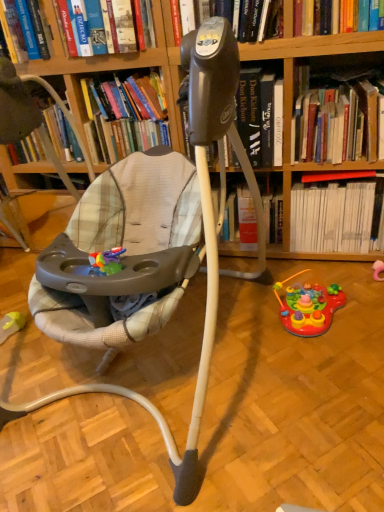
What do you see at coordinates (378, 270) in the screenshot? I see `pink rubber toy at lower right, the 1th toy viewed from the right` at bounding box center [378, 270].

Find the location of `rubber yellow toy at lower left, which is the 3th toy from right to left`. rubber yellow toy at lower left, which is the 3th toy from right to left is located at coordinates (11, 325).

Image resolution: width=384 pixels, height=512 pixels. Identify the location of black plastic tripod at center. (261, 112).

The width and height of the screenshot is (384, 512). I want to click on pink rubber toy at lower right, positioned as the 3th toy in left-to-right order, so click(x=378, y=270).

Considering the positions of objects rubberized plastic activity center at lower right, the 2th toy positioned from the left, and black plastic tripod at center in the image provided, who is more to the left, rubberized plastic activity center at lower right, the 2th toy positioned from the left, or black plastic tripod at center?

From the viewer's perspective, black plastic tripod at center appears more on the left side.

From a real-world perspective, is rubberized plastic activity center at lower right, the 2th toy positioned from the right, positioned above or below black plastic tripod at center?

In terms of real-world spatial position, rubberized plastic activity center at lower right, the 2th toy positioned from the right, is below black plastic tripod at center.

Is black plastic tripod at center at the back of rubberized plastic activity center at lower right, the 2th toy positioned from the left?

rubberized plastic activity center at lower right, the 2th toy positioned from the left, does not have its back to black plastic tripod at center.

Considering the positions of point (309, 330) and point (245, 117), is point (309, 330) closer or farther from the camera than point (245, 117)?

Clearly, point (309, 330) is closer to the camera than point (245, 117).

Consider the image. Is black plastic tripod at center facing away from hardcover book at upper right, the 3th book positioned from the left?

No, black plastic tripod at center's orientation is not away from hardcover book at upper right, the 3th book positioned from the left.

This screenshot has width=384, height=512. In order to click on the 1st book below the black plastic tripod at center (from the image's perspective) in this screenshot , I will do `click(337, 121)`.

From the image's perspective, does black plastic tripod at center appear higher than hardcover book at upper right, the 3th book positioned from the left?

Yes, from the image's perspective, black plastic tripod at center is on top of hardcover book at upper right, the 3th book positioned from the left.

Is black plastic tripod at center completely or partially outside of hardcover book at upper right, arranged as the 2th book when viewed from the right?

Yes, black plastic tripod at center is not within hardcover book at upper right, arranged as the 2th book when viewed from the right.

There is a plush fabric baby carriage at center. Identify the location of the 1st toy below it (from the image's perspective). (378, 270).

In the scene shown: From a real-world perspective, does pink rubber toy at lower right, the 1th toy viewed from the right, sit lower than plush fabric baby carriage at center?

Yes, from a real-world perspective, pink rubber toy at lower right, the 1th toy viewed from the right, is beneath plush fabric baby carriage at center.

Can you confirm if pink rubber toy at lower right, the 1th toy viewed from the right, is taller than plush fabric baby carriage at center?

In fact, pink rubber toy at lower right, the 1th toy viewed from the right, may be shorter than plush fabric baby carriage at center.

Are pink rubber toy at lower right, positioned as the 3th toy in left-to-right order, and plush fabric baby carriage at center located far from each other?

Yes, pink rubber toy at lower right, positioned as the 3th toy in left-to-right order, is far from plush fabric baby carriage at center.

Considering their positions, is pink rubber toy at lower right, the 1th toy viewed from the right, located in front of or behind rubber yellow toy at lower left, the 1th toy viewed from the left?

In the image, pink rubber toy at lower right, the 1th toy viewed from the right, appears behind rubber yellow toy at lower left, the 1th toy viewed from the left.

Is pink rubber toy at lower right, the 1th toy viewed from the right, positioned with its back to rubber yellow toy at lower left, which is the 3th toy from right to left?

No, pink rubber toy at lower right, the 1th toy viewed from the right,'s orientation is not away from rubber yellow toy at lower left, which is the 3th toy from right to left.

From a real-world perspective, which is physically below, pink rubber toy at lower right, positioned as the 3th toy in left-to-right order, or rubber yellow toy at lower left, the 1th toy viewed from the left?

In real-world perspective, pink rubber toy at lower right, positioned as the 3th toy in left-to-right order, is lower.

Is rubber yellow toy at lower left, which is the 3th toy from right to left, surrounded by pink rubber toy at lower right, positioned as the 3th toy in left-to-right order?

That's incorrect, rubber yellow toy at lower left, which is the 3th toy from right to left, is not inside pink rubber toy at lower right, positioned as the 3th toy in left-to-right order.

From the picture: Is rubber yellow toy at lower left, which is the 3th toy from right to left, aimed at pink rubber toy at lower right, positioned as the 3th toy in left-to-right order?

No.

From the image's perspective, is rubber yellow toy at lower left, the 1th toy viewed from the left, on top of pink rubber toy at lower right, the 1th toy viewed from the right?

No, from the image's perspective, rubber yellow toy at lower left, the 1th toy viewed from the left, is not on top of pink rubber toy at lower right, the 1th toy viewed from the right.

Which of these two, rubber yellow toy at lower left, the 1th toy viewed from the left, or pink rubber toy at lower right, positioned as the 3th toy in left-to-right order, is smaller?

Smaller between the two is pink rubber toy at lower right, positioned as the 3th toy in left-to-right order.

Which is behind, point (17, 331) or point (375, 270)?

The point (375, 270) is farther.

How many degrees apart are the facing directions of rubber yellow toy at lower left, the 1th toy viewed from the left, and black plastic tripod at center?

rubber yellow toy at lower left, the 1th toy viewed from the left, and black plastic tripod at center are facing 0.515 degrees away from each other.

Does rubber yellow toy at lower left, which is the 3th toy from right to left, turn towards black plastic tripod at center?

No, rubber yellow toy at lower left, which is the 3th toy from right to left, does not turn towards black plastic tripod at center.

Image resolution: width=384 pixels, height=512 pixels. In order to click on toy that is the 1st object located behind the black plastic tripod at center in this screenshot , I will do `click(11, 325)`.

In terms of width, does rubber yellow toy at lower left, which is the 3th toy from right to left, look wider or thinner when compared to black plastic tripod at center?

Considering their sizes, rubber yellow toy at lower left, which is the 3th toy from right to left, looks slimmer than black plastic tripod at center.

Is plush fabric baby carriage at center completely or partially outside of rubber yellow toy at lower left, which is the 3th toy from right to left?

Absolutely, plush fabric baby carriage at center is external to rubber yellow toy at lower left, which is the 3th toy from right to left.

From their relative heights in the image, would you say plush fabric baby carriage at center is taller or shorter than rubber yellow toy at lower left, the 1th toy viewed from the left?

Clearly, plush fabric baby carriage at center is taller compared to rubber yellow toy at lower left, the 1th toy viewed from the left.

Could you tell me if plush fabric baby carriage at center is turned towards rubber yellow toy at lower left, the 1th toy viewed from the left?

No, plush fabric baby carriage at center is not aimed at rubber yellow toy at lower left, the 1th toy viewed from the left.

Based on the photo, is the position of plush fabric baby carriage at center less distant than that of rubber yellow toy at lower left, which is the 3th toy from right to left?

Yes, it is in front of rubber yellow toy at lower left, which is the 3th toy from right to left.

Starting from the black plastic tripod at center, which toy is the 1st one to the right? Please provide its 2D coordinates.

[(308, 306)]

You are a GUI agent. You are given a task and a screenshot of the screen. Output one action in this format:
    pyautogui.click(x=<x>, y=<y>)
    Task: Click on the 1st book directly beneath the black plastic tripod at center (from a real-world perspective)
    The image size is (384, 512).
    Given the screenshot: What is the action you would take?
    pyautogui.click(x=337, y=121)

Based on their spatial positions, is hardcover book at upper center, positioned as the third book in right-to-left order, or black plastic tripod at center closer to red cardboard book at upper right, which appears as the first book when viewed from the right?

black plastic tripod at center is closer to red cardboard book at upper right, which appears as the first book when viewed from the right.

When comparing their distances from pink rubber toy at lower right, positioned as the 3th toy in left-to-right order, does hardcover book at upper center, which appears as the fourth book when viewed from the right, or rubber yellow toy at lower left, which is the 3th toy from right to left, seem further?

Among the two, hardcover book at upper center, which appears as the fourth book when viewed from the right, is located further to pink rubber toy at lower right, positioned as the 3th toy in left-to-right order.

Considering their positions, is rubberized plastic activity center at lower right, the 2th toy positioned from the left, positioned further to plush fabric baby carriage at center than rubber yellow toy at lower left, which is the 3th toy from right to left?

rubber yellow toy at lower left, which is the 3th toy from right to left, is further to plush fabric baby carriage at center.

Based on the photo, estimate the real-world distances between objects in this image. Which object is closer to hardcover book at upper center, the second book in the left-to-right sequence, rubber yellow toy at lower left, which is the 3th toy from right to left, or rubberized plastic activity center at lower right, the 2th toy positioned from the left?

Based on the image, rubberized plastic activity center at lower right, the 2th toy positioned from the left, appears to be nearer to hardcover book at upper center, the second book in the left-to-right sequence.

When comparing their distances from rubber yellow toy at lower left, the 1th toy viewed from the left, does rubberized plastic activity center at lower right, the 2th toy positioned from the right, or red cardboard book at upper right, which is the fourth book from left to right, seem further?

red cardboard book at upper right, which is the fourth book from left to right.

Looking at the image, which one is located further to pink rubber toy at lower right, positioned as the 3th toy in left-to-right order, plush fabric baby carriage at center or black plastic tripod at center?

plush fabric baby carriage at center lies further to pink rubber toy at lower right, positioned as the 3th toy in left-to-right order, than the other object.

Looking at the image, which one is located closer to rubberized plastic activity center at lower right, the 2th toy positioned from the left, hardcover book at upper center, positioned as the third book in right-to-left order, or black plastic tripod at center?

black plastic tripod at center is closer to rubberized plastic activity center at lower right, the 2th toy positioned from the left.

Which object lies further to the anchor point hardcover book at upper center, positioned as the third book in right-to-left order, rubber yellow toy at lower left, the 1th toy viewed from the left, or pink rubber toy at lower right, positioned as the 3th toy in left-to-right order?

pink rubber toy at lower right, positioned as the 3th toy in left-to-right order, is further to hardcover book at upper center, positioned as the third book in right-to-left order.

Where is `baby carriage between rubber yellow toy at lower left, which is the 3th toy from right to left, and red cardboard book at upper right, which appears as the first book when viewed from the right, from left to right`? Image resolution: width=384 pixels, height=512 pixels. baby carriage between rubber yellow toy at lower left, which is the 3th toy from right to left, and red cardboard book at upper right, which appears as the first book when viewed from the right, from left to right is located at coordinates (147, 247).

Locate an element on the screen. Image resolution: width=384 pixels, height=512 pixels. baby carriage between rubber yellow toy at lower left, the 1th toy viewed from the left, and rubberized plastic activity center at lower right, the 2th toy positioned from the right, in the horizontal direction is located at coordinates (147, 247).

You are a GUI agent. You are given a task and a screenshot of the screen. Output one action in this format:
    pyautogui.click(x=<x>, y=<y>)
    Task: Click on the shelf situated between hardcover book at upper center, the second book in the left-to-right sequence, and red cardboard book at upper right, which is the fourth book from left to right, from left to right
    
    Given the screenshot: What is the action you would take?
    pyautogui.click(x=261, y=112)

Find the location of a particular element. Image resolution: width=384 pixels, height=512 pixels. toy between rubber yellow toy at lower left, which is the 3th toy from right to left, and hardcover book at upper right, arranged as the 2th book when viewed from the right, from left to right is located at coordinates (308, 306).